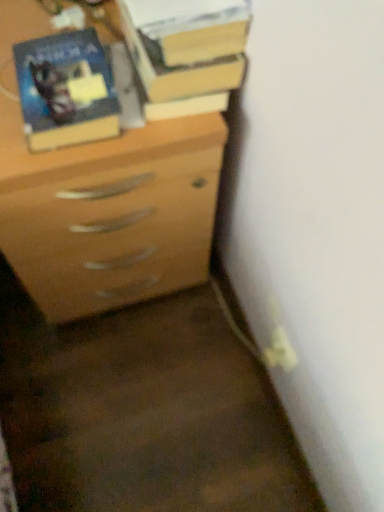
Where is `free space behind matte black book at upper left`? This screenshot has height=512, width=384. free space behind matte black book at upper left is located at coordinates (56, 33).